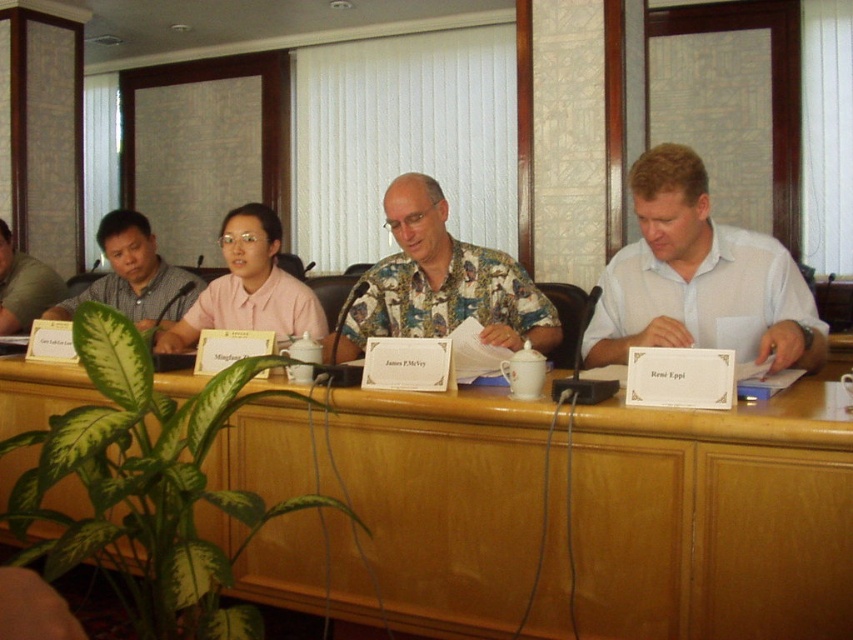
You are standing at the entrance of the conference room and need to locate the wooden table at center. According to the coordinates provided, where should you look to find it?

The wooden table at center is located at coordinates point (715, 518).

You are sitting at the conference table and need to pass a document to the person wearing the white cotton shirt at right and the floral shirt at center. Based on their positions, which person is seated farther to the right side of the table?

The white cotton shirt at right is seated farther to the right side of the table than the floral shirt at center because the white cotton shirt at right is to the right of floral shirt at center.

You are sitting at the wooden table at center and want to reach the brushed metal mug at left. Which direction should you move to get it?

Since the wooden table at center is closer to the viewer than the brushed metal mug at left, you should move towards the left side of the table to reach the mug.